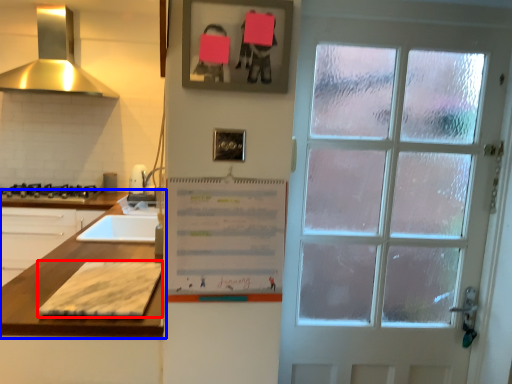
Question: Which object appears closest to the camera in this image, cardboard (highlighted by a red box) or countertop (highlighted by a blue box)?

Choices:
 (A) cardboard
 (B) countertop

Answer: (A)